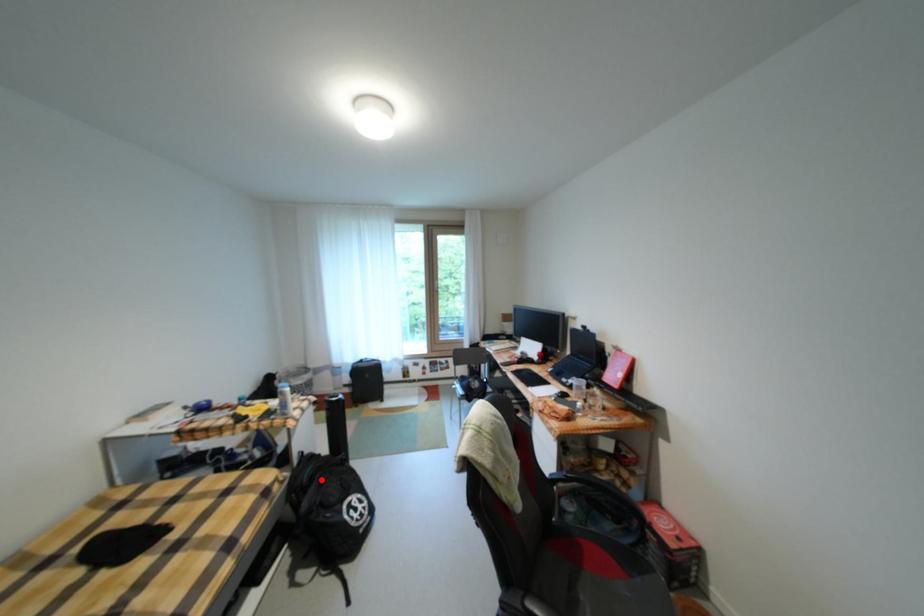
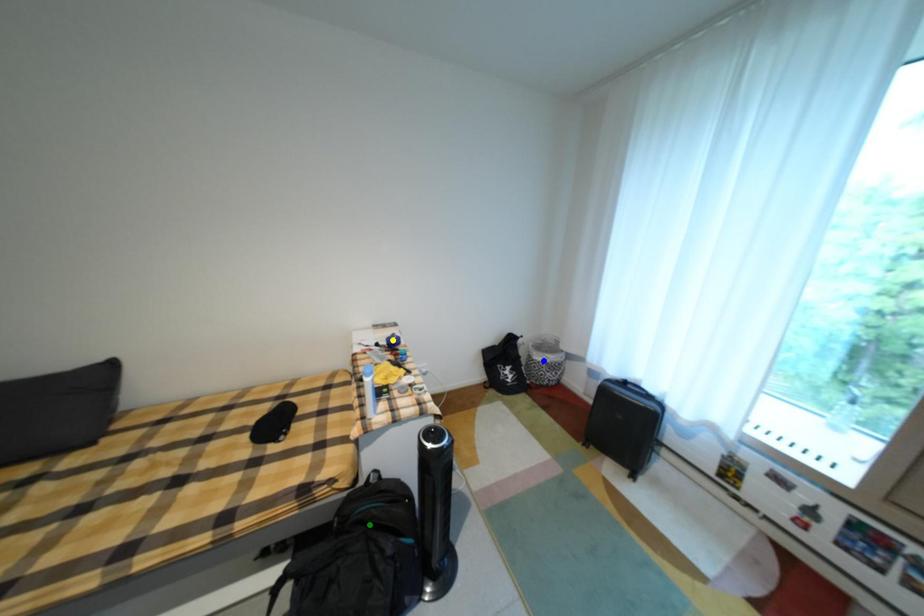
Question: I am providing you with two images of the same scene from different viewpoints. A red point is marked on the first image. You are given multiple points on the second image. Can you choose the point in image 2 that corresponds to the point in image 1?

Choices:
 (A) yellow point
 (B) blue point
 (C) green point

Answer: (C)